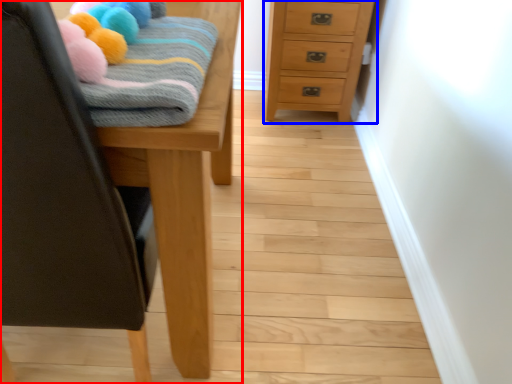
Question: Which object appears farthest to the camera in this image, furniture (highlighted by a red box) or chest of drawers (highlighted by a blue box)?

Choices:
 (A) furniture
 (B) chest of drawers

Answer: (B)